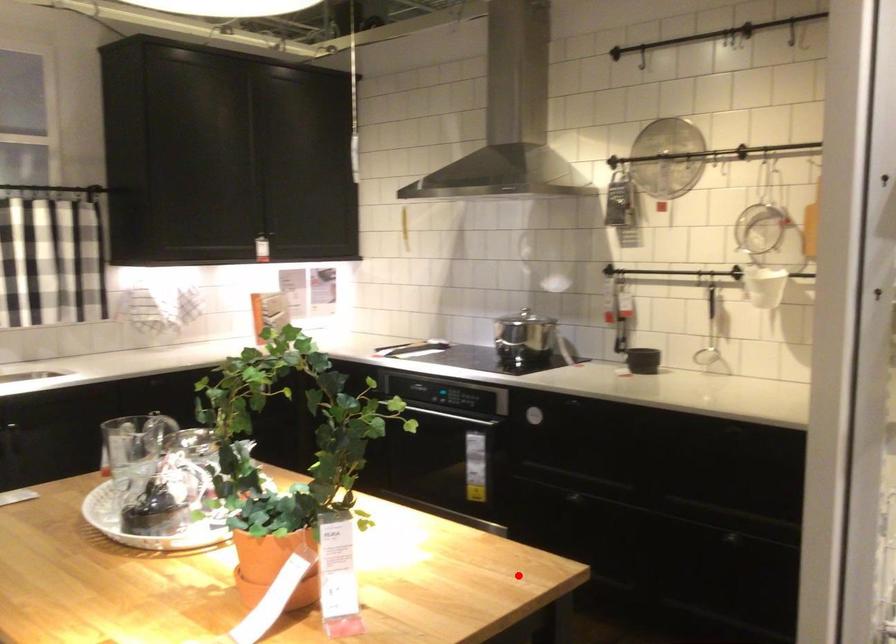
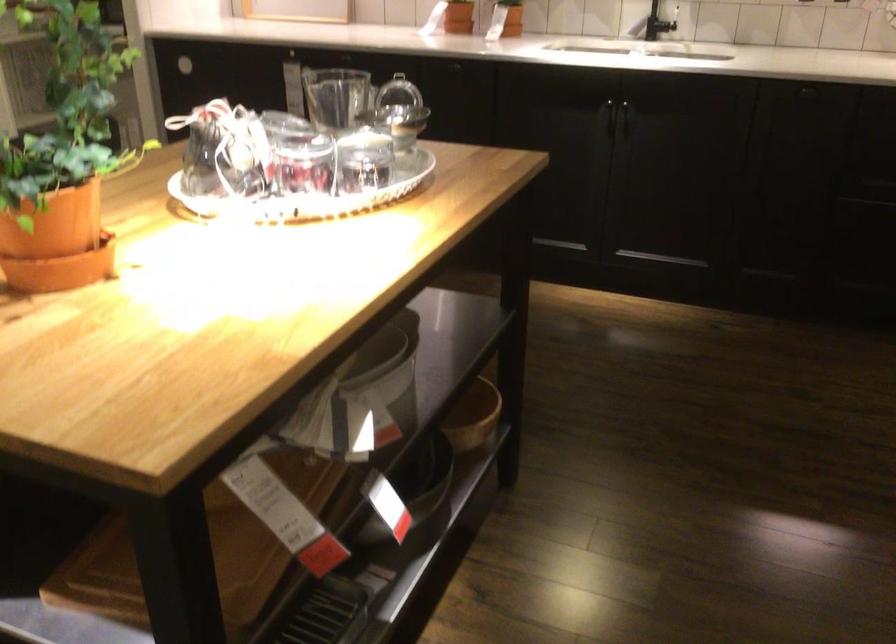
Question: I am providing you with two images of the same scene from different viewpoints. In image1, a red point is highlighted. Considering the same 3D point in image2, which of the following is correct?

Choices:
 (A) It is closer
 (B) It is farther

Answer: (A)